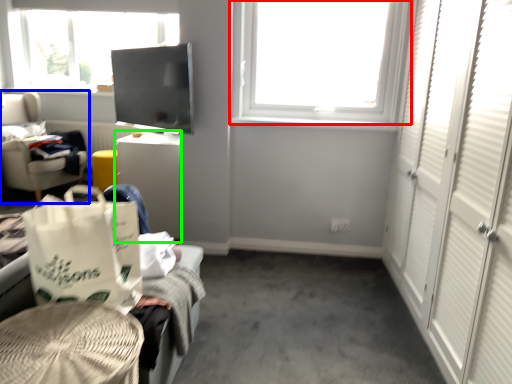
Question: Estimate the real-world distances between objects in this image. Which object is farther from window (highlighted by a red box), chair (highlighted by a blue box) or desk (highlighted by a green box)?

Choices:
 (A) chair
 (B) desk

Answer: (A)